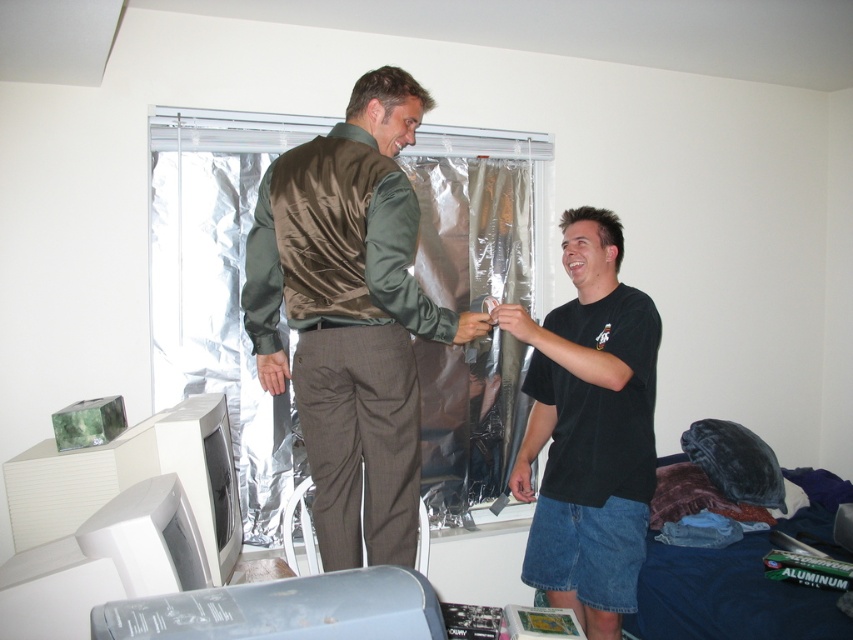
Question: Considering the relative positions of satin brown vest at center and black matte t-shirt at center in the image provided, where is satin brown vest at center located with respect to black matte t-shirt at center?

Choices:
 (A) above
 (B) below

Answer: (A)

Question: Which of the following is the closest to the observer?

Choices:
 (A) black matte t-shirt at center
 (B) satin brown vest at center

Answer: (B)

Question: Does satin brown vest at center have a larger size compared to black matte t-shirt at center?

Choices:
 (A) yes
 (B) no

Answer: (A)

Question: Which object appears closest to the camera in this image?

Choices:
 (A) satin brown vest at center
 (B) black matte t-shirt at center

Answer: (A)

Question: Considering the relative positions of satin brown vest at center and black matte t-shirt at center in the image provided, where is satin brown vest at center located with respect to black matte t-shirt at center?

Choices:
 (A) right
 (B) left

Answer: (B)